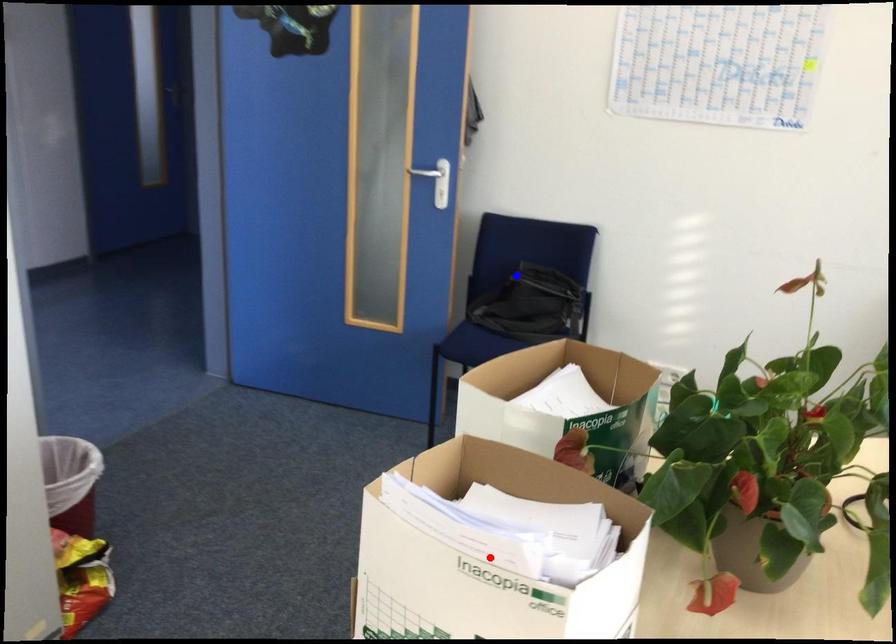
Question: Which of the two points in the image is closer to the camera?

Choices:
 (A) Blue point is closer.
 (B) Red point is closer.

Answer: (B)